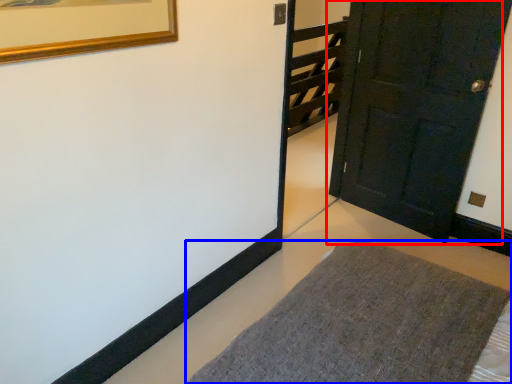
Question: Which point is further to the camera, door (highlighted by a red box) or furniture (highlighted by a blue box)?

Choices:
 (A) door
 (B) furniture

Answer: (A)